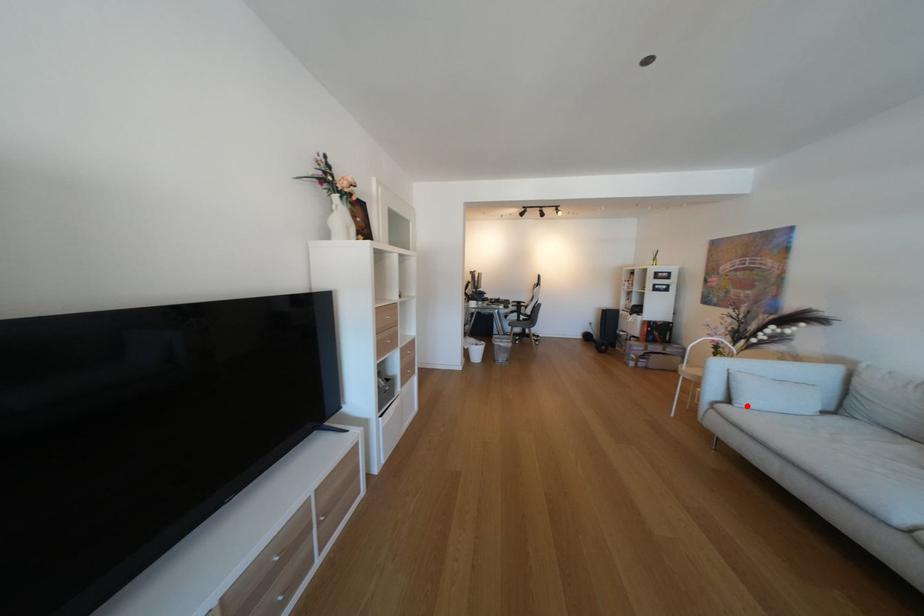
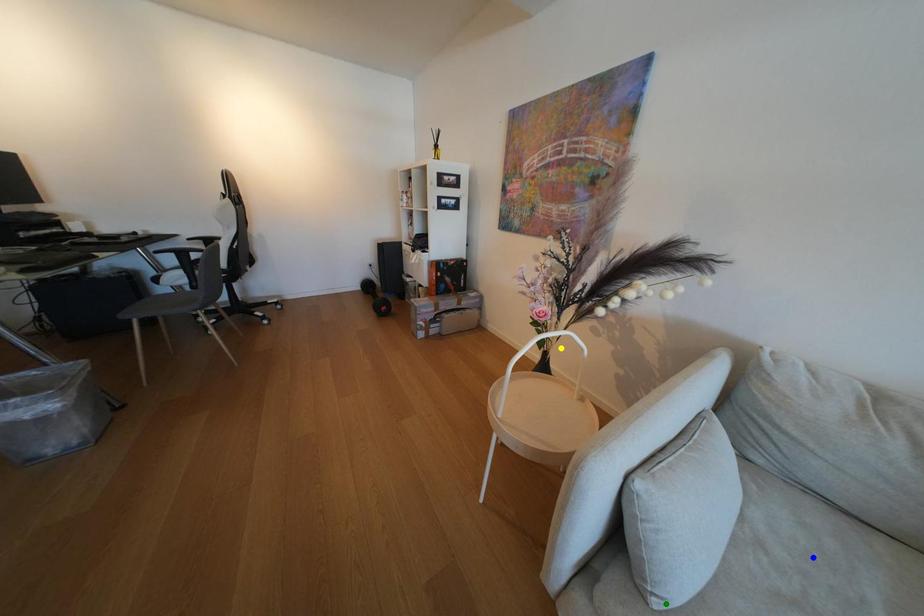
Question: I am providing you with two images of the same scene from different viewpoints. A red point is marked on the first image. You are given multiple points on the second image. Can you choose the point in image 2 that corresponds to the point in image 1?

Choices:
 (A) yellow point
 (B) blue point
 (C) green point

Answer: (C)